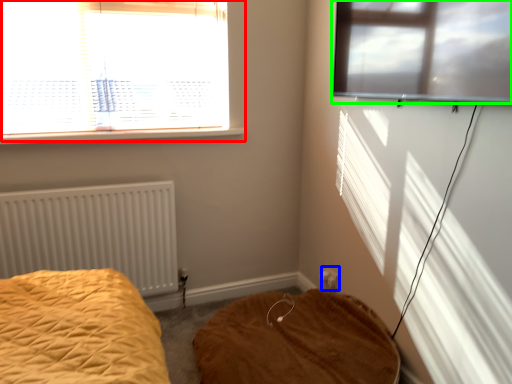
Question: Which is nearer to the window (highlighted by a red box)? electric outlet (highlighted by a blue box) or window (highlighted by a green box).

Choices:
 (A) electric outlet
 (B) window

Answer: (B)